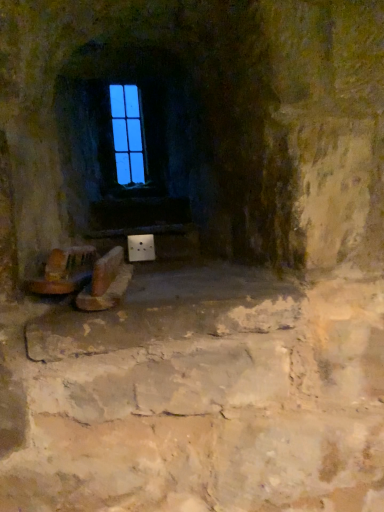
You are a GUI agent. You are given a task and a screenshot of the screen. Output one action in this format:
    pyautogui.click(x=<x>, y=<y>)
    Task: Click on the wooden chair at lower left
    Image resolution: width=384 pixels, height=512 pixels.
    Given the screenshot: What is the action you would take?
    pyautogui.click(x=64, y=271)

This screenshot has height=512, width=384. Identify the location of brown leather shoes at lower center. (106, 282).

The image size is (384, 512). Identify the location of wooden chair at lower left. (64, 271).

Is brown leather shoes at lower center far away from wooden chair at lower left?

No.

Considering the points (81, 290) and (73, 268), which point is behind, point (81, 290) or point (73, 268)?

The point (73, 268) is farther from the camera.

Considering the positions of objects brown leather shoes at lower center and wooden chair at lower left in the image provided, who is more to the right, brown leather shoes at lower center or wooden chair at lower left?

brown leather shoes at lower center is more to the right.

Is brown leather shoes at lower center bigger or smaller than wooden chair at lower left?

brown leather shoes at lower center is bigger than wooden chair at lower left.

Is brown leather shoes at lower center in front of blue glass window at upper center?

Yes, the depth of brown leather shoes at lower center is less than that of blue glass window at upper center.

The height and width of the screenshot is (512, 384). Find the location of `footwear that is on the right side of blue glass window at upper center`. footwear that is on the right side of blue glass window at upper center is located at coordinates (106, 282).

Consider the image. Measure the distance from brown leather shoes at lower center to blue glass window at upper center.

brown leather shoes at lower center is 1.10 meters from blue glass window at upper center.

Considering the relative sizes of brown leather shoes at lower center and blue glass window at upper center in the image provided, is brown leather shoes at lower center bigger than blue glass window at upper center?

Indeed, brown leather shoes at lower center has a larger size compared to blue glass window at upper center.

Based on the photo, is the position of blue glass window at upper center less distant than that of wooden chair at lower left?

No, it is behind wooden chair at lower left.

Does blue glass window at upper center turn towards wooden chair at lower left?

Yes, blue glass window at upper center faces towards wooden chair at lower left.

From the image's perspective, between blue glass window at upper center and wooden chair at lower left, who is located below?

wooden chair at lower left appears lower in the image.

Looking at their sizes, would you say wooden chair at lower left is wider or thinner than blue glass window at upper center?

Clearly, wooden chair at lower left has more width compared to blue glass window at upper center.

From the image's perspective, which one is positioned lower, wooden chair at lower left or blue glass window at upper center?

wooden chair at lower left is shown below in the image.

How distant is wooden chair at lower left from blue glass window at upper center?

wooden chair at lower left and blue glass window at upper center are 3.60 feet apart.

From their relative heights in the image, would you say wooden chair at lower left is taller or shorter than blue glass window at upper center?

Clearly, wooden chair at lower left is shorter compared to blue glass window at upper center.

From the image's perspective, between wooden chair at lower left and brown leather shoes at lower center, who is located below?

brown leather shoes at lower center appears lower in the image.

Between wooden chair at lower left and brown leather shoes at lower center, which one appears on the right side from the viewer's perspective?

From the viewer's perspective, brown leather shoes at lower center appears more on the right side.

Find the location of a particular element. Image resolution: width=384 pixels, height=512 pixels. footwear lying below the wooden chair at lower left (from the image's perspective) is located at coordinates (106, 282).

Does blue glass window at upper center have a smaller size compared to brown leather shoes at lower center?

Correct, blue glass window at upper center occupies less space than brown leather shoes at lower center.

Consider the image. Is blue glass window at upper center in front of or behind brown leather shoes at lower center in the image?

Clearly, blue glass window at upper center is behind brown leather shoes at lower center.

Based on the photo, between blue glass window at upper center and brown leather shoes at lower center, which one has smaller width?

blue glass window at upper center is thinner.

From the image's perspective, is blue glass window at upper center positioned above or below brown leather shoes at lower center?

blue glass window at upper center is situated higher than brown leather shoes at lower center in the image.

The image size is (384, 512). Find the location of `footwear that is in front of the wooden chair at lower left`. footwear that is in front of the wooden chair at lower left is located at coordinates (106, 282).

Find the location of a particular element. window above the brown leather shoes at lower center (from the image's perspective) is located at coordinates (124, 138).

When comparing their distances from brown leather shoes at lower center, does wooden chair at lower left or blue glass window at upper center seem further?

blue glass window at upper center.

Based on their spatial positions, is blue glass window at upper center or wooden chair at lower left closer to brown leather shoes at lower center?

Based on the image, wooden chair at lower left appears to be nearer to brown leather shoes at lower center.

Based on their spatial positions, is brown leather shoes at lower center or blue glass window at upper center closer to wooden chair at lower left?

brown leather shoes at lower center is positioned closer to the anchor wooden chair at lower left.

From the picture: Which object lies nearer to the anchor point wooden chair at lower left, blue glass window at upper center or brown leather shoes at lower center?

The object closer to wooden chair at lower left is brown leather shoes at lower center.

Estimate the real-world distances between objects in this image. Which object is closer to blue glass window at upper center, wooden chair at lower left or brown leather shoes at lower center?

Based on the image, wooden chair at lower left appears to be nearer to blue glass window at upper center.

When comparing their distances from blue glass window at upper center, does brown leather shoes at lower center or wooden chair at lower left seem closer?

wooden chair at lower left is positioned closer to the anchor blue glass window at upper center.

This screenshot has width=384, height=512. Find the location of `chair between brown leather shoes at lower center and blue glass window at upper center along the z-axis`. chair between brown leather shoes at lower center and blue glass window at upper center along the z-axis is located at coordinates (64, 271).